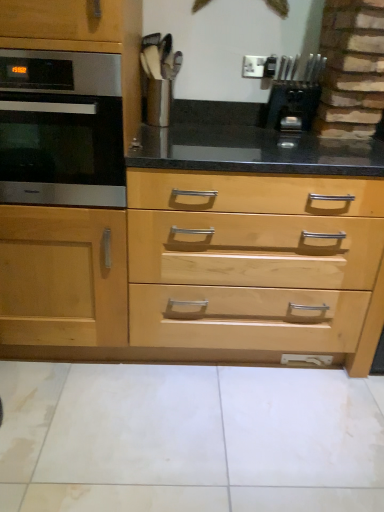
Question: In terms of height, does black plastic knife block at upper right look taller or shorter compared to satin black oven at left?

Choices:
 (A) short
 (B) tall

Answer: (A)

Question: Relative to satin black oven at left, is black plastic knife block at upper right in front or behind?

Choices:
 (A) front
 (B) behind

Answer: (B)

Question: Estimate the real-world distances between objects in this image. Which object is farther from the black plastic knife block at upper right?

Choices:
 (A) satin black oven at left
 (B) natural wood drawer at center

Answer: (A)

Question: Which object is the closest to the black plastic knife block at upper right?

Choices:
 (A) satin black oven at left
 (B) natural wood drawer at center

Answer: (B)